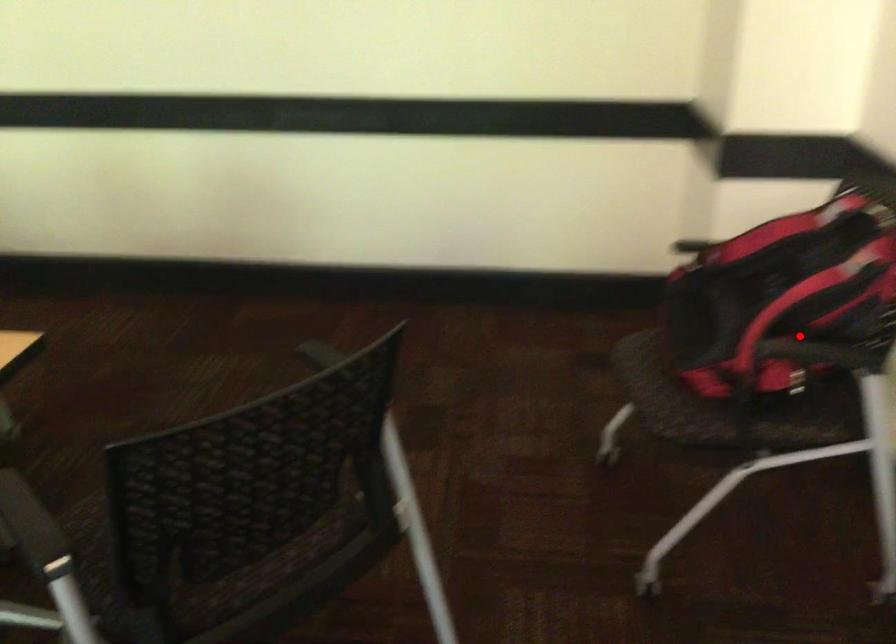
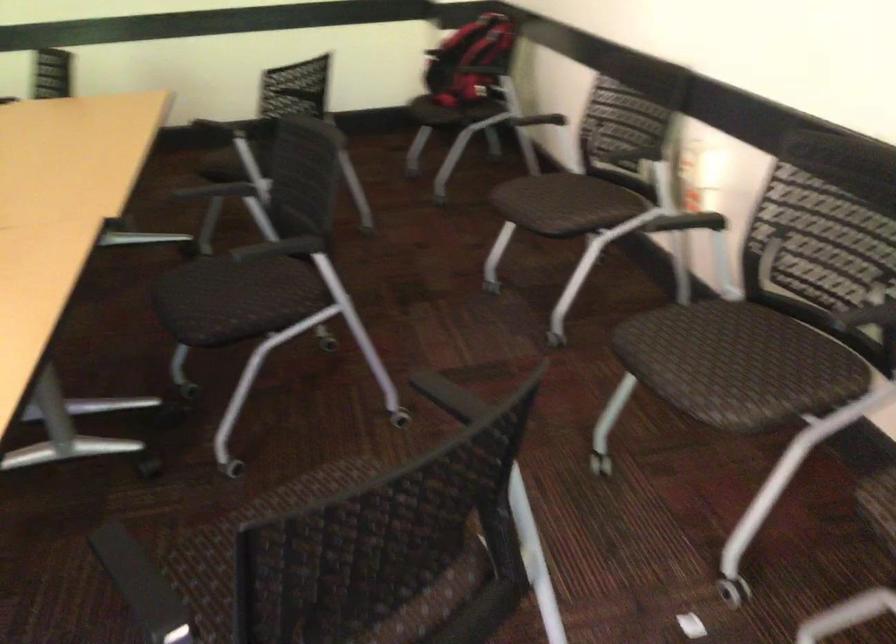
Locate, in the second image, the point that corresponds to the highlighted location in the first image.

(471, 61)